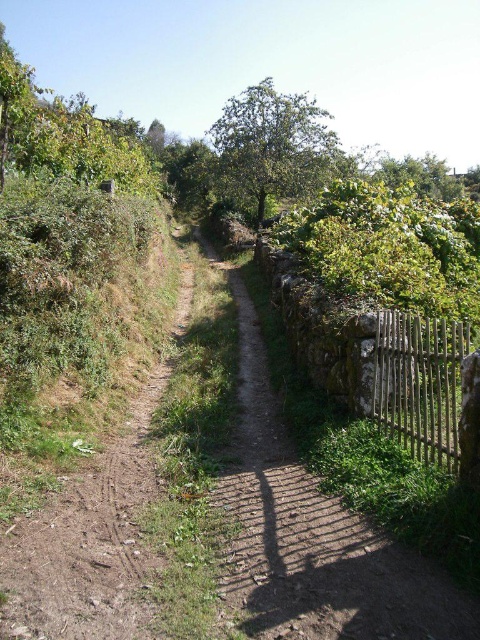
You are standing at the point marked by the coordinate point at point (420, 384). You want to walk along the path to the left. Which side of the path will you be facing towards the dense greenery and bushes?

The wooden fence at right is located at point (420, 384). When facing left along the path, the dense greenery and bushes are on your right side.

You are a hiker carrying a 20 meter long rope. You want to string the rope between the wooden fence at right and the green leafy tree at center to hang a hammock. Will the rope be long enough?

The wooden fence at right and green leafy tree at center are 19.37 meters apart from each other. The rope is 20 meters long, so it will be long enough to string between them.